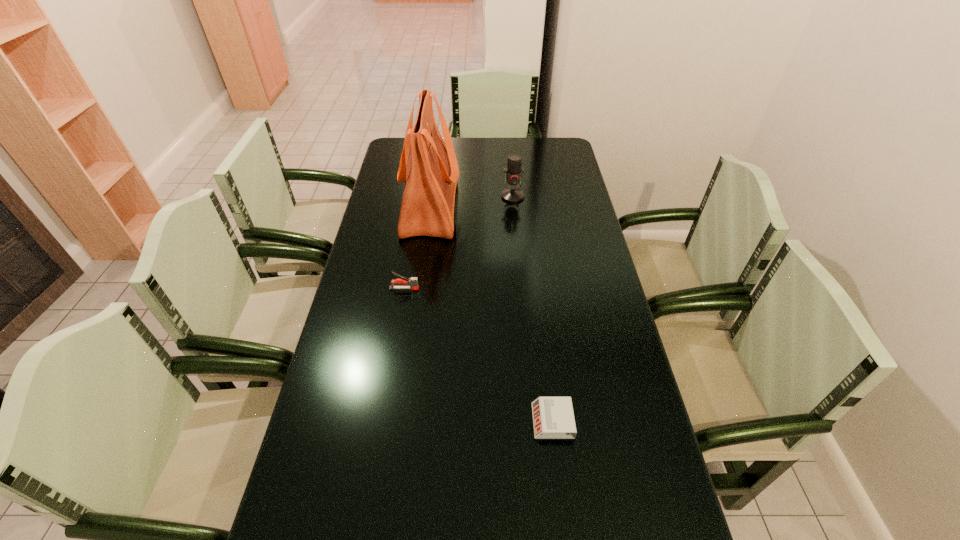
Where is `shopping bag that is at the left edge`? The image size is (960, 540). shopping bag that is at the left edge is located at coordinates 430,174.

In order to click on stapler that is at the left edge in this screenshot , I will do `click(413, 281)`.

The width and height of the screenshot is (960, 540). In the image, there is a desktop. Identify the location of vacant space at the far edge. (481, 138).

In the image, there is a desktop. Where is `free space at the left edge`? This screenshot has width=960, height=540. free space at the left edge is located at coordinates (376, 208).

Locate an element on the screen. This screenshot has width=960, height=540. vacant space at the right edge of the desktop is located at coordinates [599, 329].

Find the location of `free space between the second tallest object and the tallest object`. free space between the second tallest object and the tallest object is located at coordinates (471, 201).

Find the location of a particular element. The width and height of the screenshot is (960, 540). vacant space in between the shortest object and the tallest object is located at coordinates (492, 314).

Locate an element on the screen. The image size is (960, 540). vacant point located between the second nearest object and the shortest object is located at coordinates (478, 355).

In order to click on free space between the microphone and the tallest object in this screenshot , I will do `click(471, 201)`.

Locate an element on the screen. The height and width of the screenshot is (540, 960). vacant area between the stapler and the shortest object is located at coordinates (478, 355).